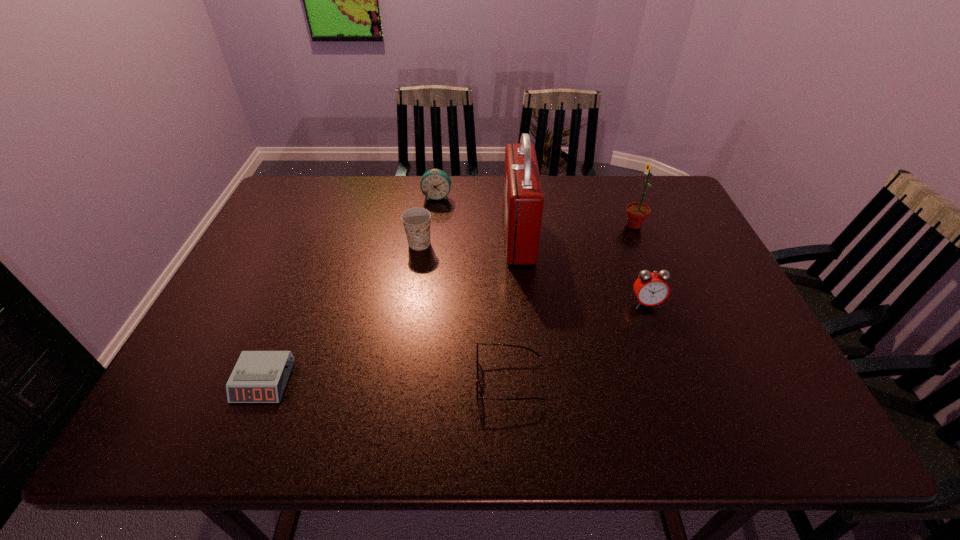
Find the location of `vacant space at the far edge of the desktop`. vacant space at the far edge of the desktop is located at coordinates click(382, 190).

In the image, there is a desktop. At what (x,y) coordinates should I click in order to perform the action: click on free region at the near edge. Please return your answer as a coordinate pair (x, y). Looking at the image, I should click on (429, 416).

The height and width of the screenshot is (540, 960). In the image, there is a desktop. In order to click on vacant space at the left edge in this screenshot , I will do `click(237, 349)`.

Locate an element on the screen. This screenshot has width=960, height=540. free space at the right edge is located at coordinates (661, 222).

At what (x,y) coordinates should I click in order to perform the action: click on vacant region at the far left corner of the desktop. Please return your answer as a coordinate pair (x, y). Looking at the image, I should click on (304, 217).

You are a GUI agent. You are given a task and a screenshot of the screen. Output one action in this format:
    pyautogui.click(x=<x>, y=<y>)
    Task: Click on the blank region between the second alarm clock from right to left and the first-aid kit
    The width and height of the screenshot is (960, 540).
    Given the screenshot: What is the action you would take?
    pyautogui.click(x=478, y=216)

Where is `free space between the spectacles and the first-aid kit`? This screenshot has width=960, height=540. free space between the spectacles and the first-aid kit is located at coordinates (514, 308).

The width and height of the screenshot is (960, 540). In order to click on unoccupied area between the shortest object and the Dixie cup in this screenshot , I will do `click(342, 313)`.

The height and width of the screenshot is (540, 960). I want to click on vacant space in between the second shortest object and the second farthest alarm clock, so click(578, 342).

Identify the location of free spot between the leftmost alarm clock and the second farthest alarm clock. The width and height of the screenshot is (960, 540). (455, 342).